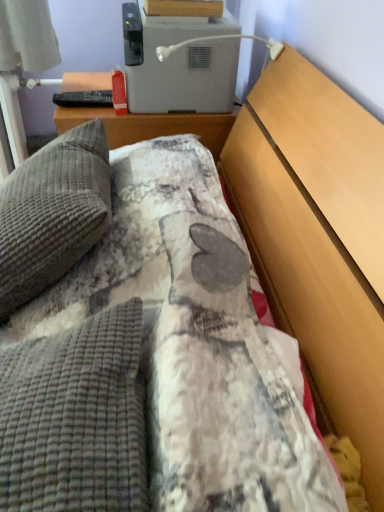
Describe the element at coordinates (52, 213) in the screenshot. This screenshot has width=384, height=512. I see `gray textured pillow at left` at that location.

Image resolution: width=384 pixels, height=512 pixels. What are the coordinates of `gray textured pillow at left` in the screenshot? It's located at (52, 213).

What do you see at coordinates (179, 63) in the screenshot?
I see `white plastic toaster at upper center` at bounding box center [179, 63].

What is the approximate height of white plastic toaster at upper center?

10.87 inches.

Locate an element on the screen. white plastic toaster at upper center is located at coordinates (179, 63).

Where is `gray textured pillow at left`? The width and height of the screenshot is (384, 512). gray textured pillow at left is located at coordinates (52, 213).

Considering the relative positions of white plastic toaster at upper center and gray textured pillow at left in the image provided, is white plastic toaster at upper center to the left or to the right of gray textured pillow at left?

In the image, white plastic toaster at upper center appears on the right side of gray textured pillow at left.

Between white plastic toaster at upper center and gray textured pillow at left, which one is positioned behind?

white plastic toaster at upper center is further from the camera.

Does point (165, 77) come behind point (7, 306)?

Yes.

From the image's perspective, does white plastic toaster at upper center appear lower than gray textured pillow at left?

No.

From a real-world perspective, is white plastic toaster at upper center below gray textured pillow at left?

Actually, white plastic toaster at upper center is physically above gray textured pillow at left in the real world.

Considering the sizes of white plastic toaster at upper center and gray textured pillow at left in the image, is white plastic toaster at upper center wider or thinner than gray textured pillow at left?

Considering their sizes, white plastic toaster at upper center looks broader than gray textured pillow at left.

Can you confirm if white plastic toaster at upper center is taller than gray textured pillow at left?

Incorrect, the height of white plastic toaster at upper center is not larger of that of gray textured pillow at left.

Between white plastic toaster at upper center and gray textured pillow at left, which one has smaller size?

With smaller size is white plastic toaster at upper center.

Is gray textured pillow at left located within white plastic toaster at upper center?

No, gray textured pillow at left is located outside of white plastic toaster at upper center.

Would you consider white plastic toaster at upper center to be distant from gray textured pillow at left?

No.

Does white plastic toaster at upper center turn towards gray textured pillow at left?

No, white plastic toaster at upper center does not turn towards gray textured pillow at left.

How different are the orientations of white plastic toaster at upper center and gray textured pillow at left in degrees?

They differ by 1.31 degrees in their facing directions.

Locate an element on the screen. pillow located below the white plastic toaster at upper center (from the image's perspective) is located at coordinates (52, 213).

Can you confirm if gray textured pillow at left is positioned to the right of white plastic toaster at upper center?

Incorrect, gray textured pillow at left is not on the right side of white plastic toaster at upper center.

Looking at this image, is gray textured pillow at left positioned behind white plastic toaster at upper center?

No, gray textured pillow at left is closer to the viewer.

Does point (85, 135) come closer to viewer compared to point (234, 27)?

Yes, point (85, 135) is closer to viewer.

From the image's perspective, would you say gray textured pillow at left is shown under white plastic toaster at upper center?

Yes, from the image's perspective, gray textured pillow at left is below white plastic toaster at upper center.

From a real-world perspective, is gray textured pillow at left on top of white plastic toaster at upper center?

Actually, gray textured pillow at left is physically below white plastic toaster at upper center in the real world.

Which of these two, gray textured pillow at left or white plastic toaster at upper center, is wider?

white plastic toaster at upper center.

Considering the relative sizes of gray textured pillow at left and white plastic toaster at upper center in the image provided, is gray textured pillow at left shorter than white plastic toaster at upper center?

No.

Who is bigger, gray textured pillow at left or white plastic toaster at upper center?

gray textured pillow at left is bigger.

Based on the photo, would you say gray textured pillow at left is outside white plastic toaster at upper center?

Yes.

Would you consider gray textured pillow at left to be distant from white plastic toaster at upper center?

No, there isn't a large distance between gray textured pillow at left and white plastic toaster at upper center.

Is gray textured pillow at left oriented away from white plastic toaster at upper center?

No, gray textured pillow at left is not facing the opposite direction of white plastic toaster at upper center.

Locate an element on the screen. The height and width of the screenshot is (512, 384). pillow on the left of white plastic toaster at upper center is located at coordinates (52, 213).

There is a gray textured pillow at left. Where is `appliance above it (from a real-world perspective)`? The image size is (384, 512). appliance above it (from a real-world perspective) is located at coordinates (179, 63).

Find the location of `pillow that appears on the left of white plastic toaster at upper center`. pillow that appears on the left of white plastic toaster at upper center is located at coordinates (52, 213).